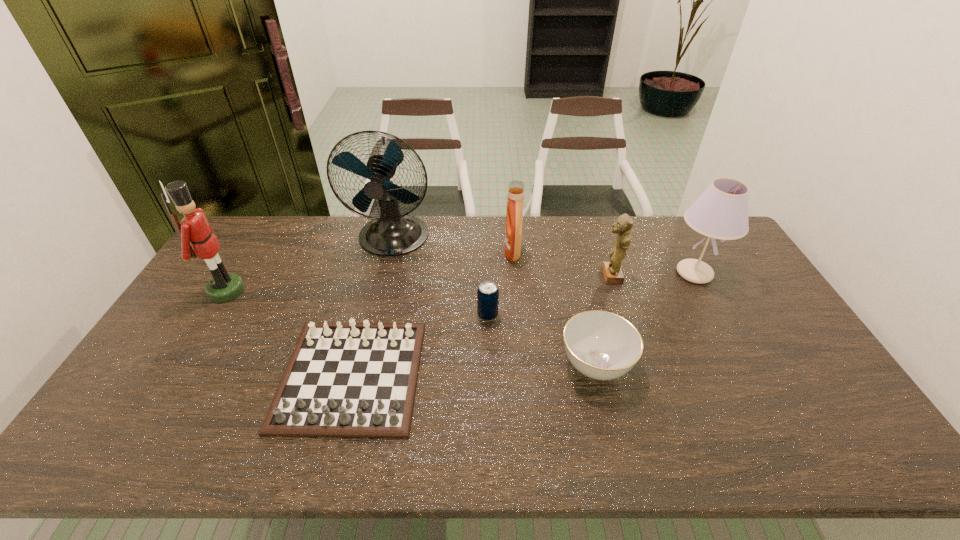
This screenshot has height=540, width=960. Identify the location of fan. (391, 234).

Find the location of a particular element. The image size is (960, 540). nutcracker is located at coordinates (194, 227).

Locate an element on the screen. lampshade is located at coordinates (721, 212).

Identify the location of the third tallest object. The image size is (960, 540). (721, 212).

Locate an element on the screen. The image size is (960, 540). detergent is located at coordinates (513, 232).

The width and height of the screenshot is (960, 540). What are the coordinates of `figurine` in the screenshot? It's located at [612, 272].

Find the location of a particular element. The width and height of the screenshot is (960, 540). soda can is located at coordinates (487, 294).

You are a GUI agent. You are given a task and a screenshot of the screen. Output one action in this format:
    pyautogui.click(x=<x>, y=<y>)
    Task: Click on the sixth farthest object
    The width and height of the screenshot is (960, 540).
    Given the screenshot: What is the action you would take?
    pyautogui.click(x=487, y=294)

Find the location of a particular element. This screenshot has height=540, width=960. chinaware is located at coordinates (601, 345).

The height and width of the screenshot is (540, 960). In order to click on chessboard in this screenshot , I will do `click(353, 380)`.